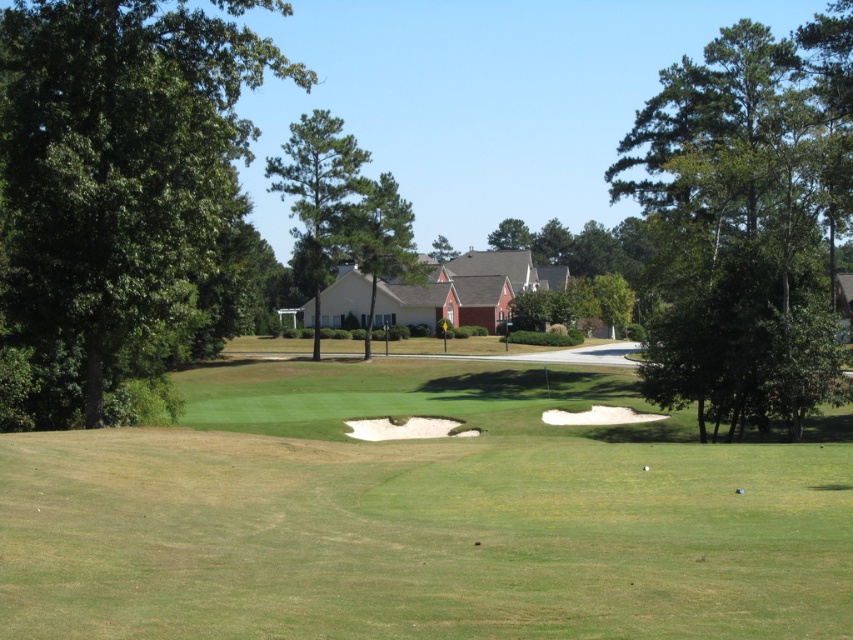
You are a golfer standing on the green grassy golf course at center. You want to hit a ball towards the green leafy tree at upper right. Will the tree be visible to you while taking your shot?

The green leafy tree at upper right is taller than the green grassy golf course at center, so yes, the tree will be visible as you take your shot since it stands above the shorter grass.

You are a golfer standing on the fairway and see the green leafy tree at left and the green leafy tree at center. Which tree is positioned more to your left side?

The green leafy tree at left is positioned more to the left side compared to the green leafy tree at center.

You are a golfer standing on the fairway and want to hit a ball towards the houses. Which tree, the green leafy tree at left or the green leafy tree at center, would you have to aim over if you want to clear both?

The green leafy tree at center is taller than the green leafy tree at left, so you would need to aim over the green leafy tree at center to clear both.